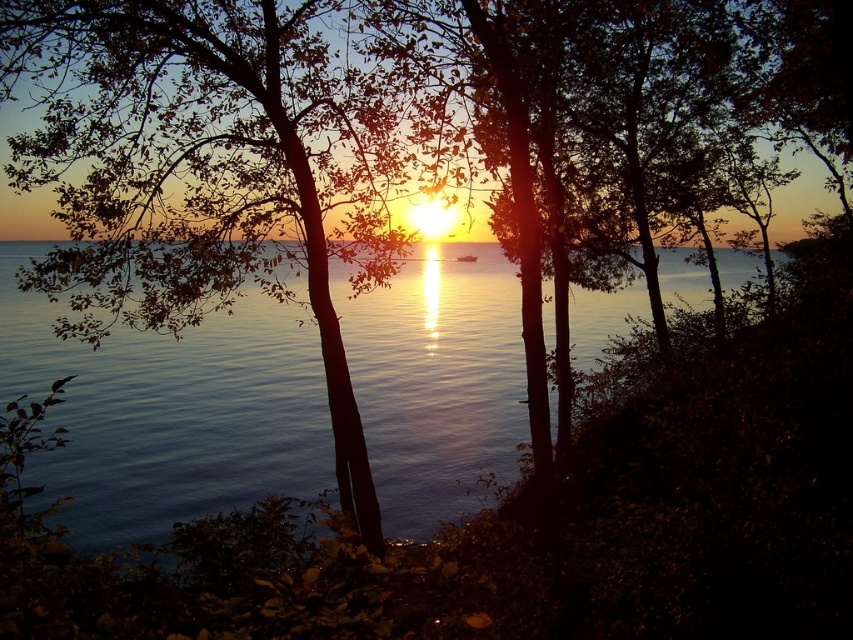
You are a photographer trying to capture the sunset reflection on the glistening blue water at center. You notice the green leafy tree at center might block your view. Is the tree to the left or right of the water?

The green leafy tree at center is positioned on the left side of glistening blue water at center, so the tree is to the left of the water.

From the picture: You are standing at the edge of the water in the sunset scene. You notice two points in the distance. The first point is located at coordinates point (247, 269), and the second point is at point (544, 320). Which of these two points appears closer to you?

Point (247, 269) is closer to the viewer than point (544, 320).

You are a photographer who wants to capture the sunset reflection on the glistening blue water at center without the green leafy tree at center blocking the view. Based on their heights, is it possible to position yourself lower to the ground to achieve this?

The green leafy tree at center is shorter than the glistening blue water at center, so positioning yourself lower to the ground might allow you to capture the sunset reflection on the glistening blue water at center without the tree blocking the view.